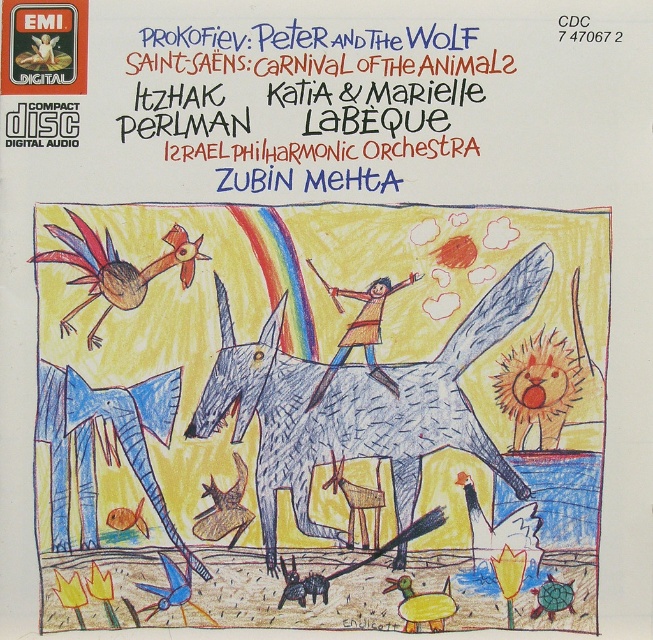
Who is higher up, blue ink text at upper center or blue crayon elephant at lower left?

Positioned higher is blue ink text at upper center.

Is point (415, 147) farther from viewer compared to point (104, 452)?

Yes, point (415, 147) is farther from viewer.

Where is `blue ink text at upper center`? This screenshot has height=640, width=653. blue ink text at upper center is located at coordinates (315, 100).

Is blue crayon elephant at lower left shorter than colored pencil rooster at upper left?

In fact, blue crayon elephant at lower left may be taller than colored pencil rooster at upper left.

Which is behind, point (142, 472) or point (202, 253)?

Point (202, 253)

Image resolution: width=653 pixels, height=640 pixels. Find the location of `blue crayon elephant at lower left`. blue crayon elephant at lower left is located at coordinates (103, 444).

In the scene shown: Is gray scribbled donkey at center taller than colored pencil rooster at upper left?

Correct, gray scribbled donkey at center is much taller as colored pencil rooster at upper left.

Which is more to the right, gray scribbled donkey at center or colored pencil rooster at upper left?

From the viewer's perspective, gray scribbled donkey at center appears more on the right side.

At what (x,y) coordinates should I click in order to perform the action: click on gray scribbled donkey at center. Please return your answer as a coordinate pair (x, y). Image resolution: width=653 pixels, height=640 pixels. Looking at the image, I should click on (358, 404).

Image resolution: width=653 pixels, height=640 pixels. What are the coordinates of `gray scribbled donkey at center` in the screenshot? It's located at (358, 404).